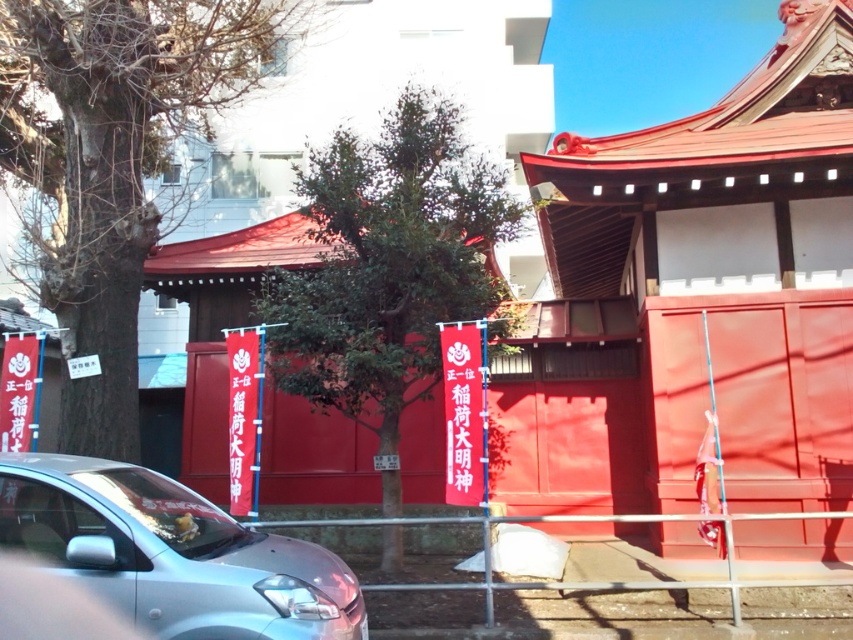
Does smooth red temple at center have a smaller size compared to silver metallic car at lower left?

Correct, smooth red temple at center occupies less space than silver metallic car at lower left.

Describe the element at coordinates (727, 268) in the screenshot. This screenshot has height=640, width=853. I see `smooth red temple at center` at that location.

Is point (672, 310) closer to camera compared to point (125, 612)?

No, (672, 310) is further to viewer.

Locate an element on the screen. smooth red temple at center is located at coordinates (727, 268).

Between bare wood tree at left and silver metallic car at lower left, which one has less height?

silver metallic car at lower left is shorter.

Is point (93, 10) behind point (202, 600)?

Yes, point (93, 10) is behind point (202, 600).

Which is behind, point (170, 38) or point (0, 513)?

The point (170, 38) is more distant.

The image size is (853, 640). Identify the location of bare wood tree at left. (114, 161).

Is point (380, 448) farther from camera compared to point (206, 634)?

Yes, point (380, 448) is behind point (206, 634).

This screenshot has height=640, width=853. In order to click on green leafy tree at center in this screenshot , I will do `click(387, 268)`.